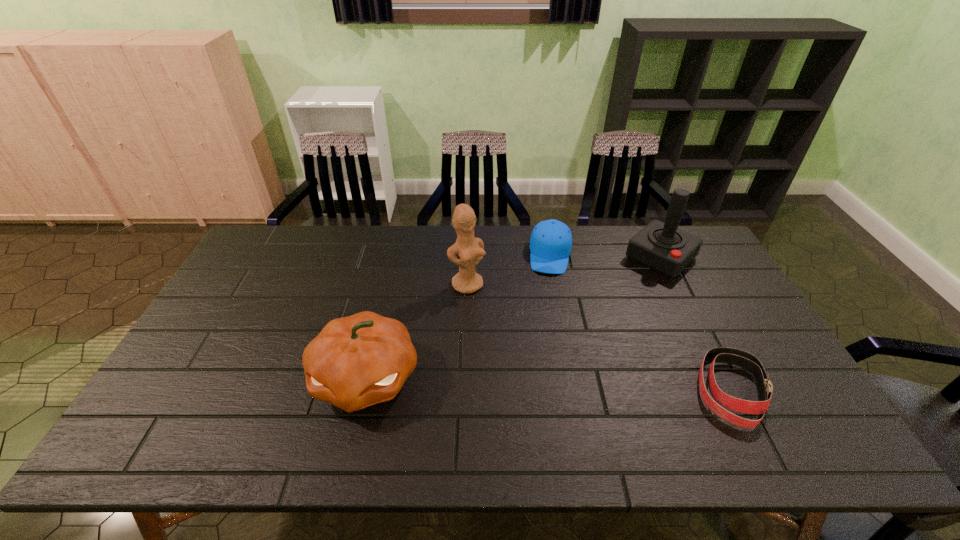
You are a GUI agent. You are given a task and a screenshot of the screen. Output one action in this format:
    pyautogui.click(x=<x>, y=<y>)
    Task: Click on the vacant space on the desktop that is between the pumpkin and the dog collar and is positioned on the front-facing side of the figurine
    Image resolution: width=960 pixels, height=540 pixels.
    Given the screenshot: What is the action you would take?
    pyautogui.click(x=545, y=384)

You are a GUI agent. You are given a task and a screenshot of the screen. Output one action in this format:
    pyautogui.click(x=<x>, y=<y>)
    Task: Click on the vacant spot on the desktop that is between the leftmost object and the dog collar and is positioned on the front-facing side of the third object from left to right
    This screenshot has width=960, height=540.
    Given the screenshot: What is the action you would take?
    pyautogui.click(x=540, y=384)

I want to click on free space on the desktop that is between the leftmost object and the dog collar and is positioned on the base of the joystick, so click(526, 383).